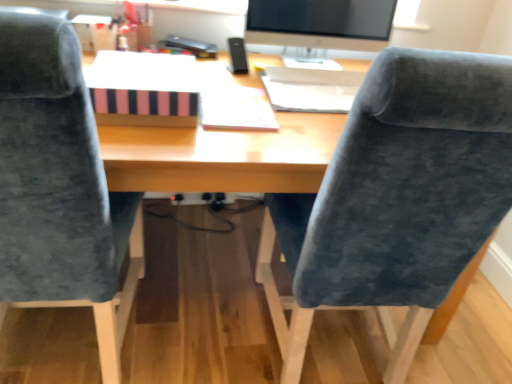
The height and width of the screenshot is (384, 512). Identify the location of vacant area located to the right-hand side of white paper at center. (311, 126).